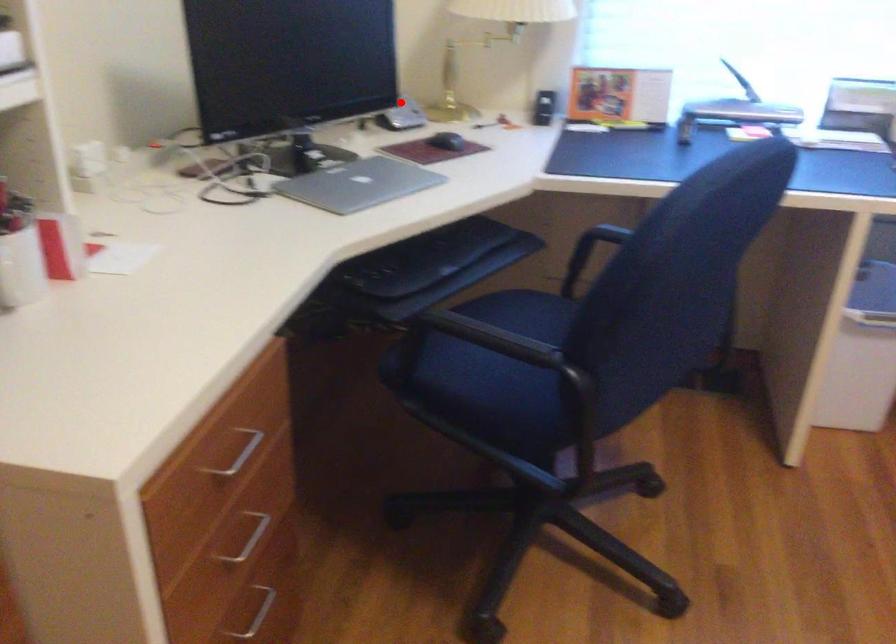
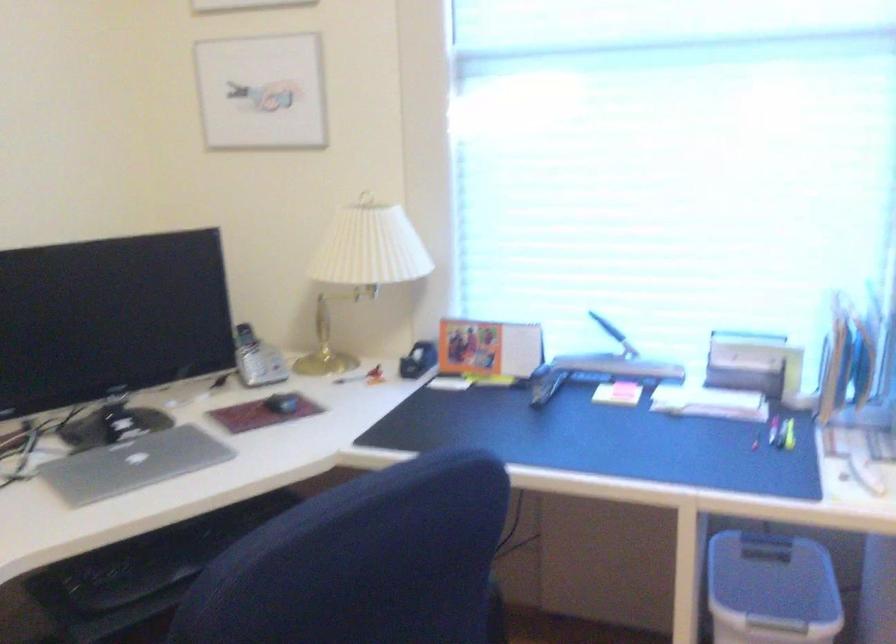
In the second image, find the point that corresponds to the highlighted location in the first image.

(256, 359)